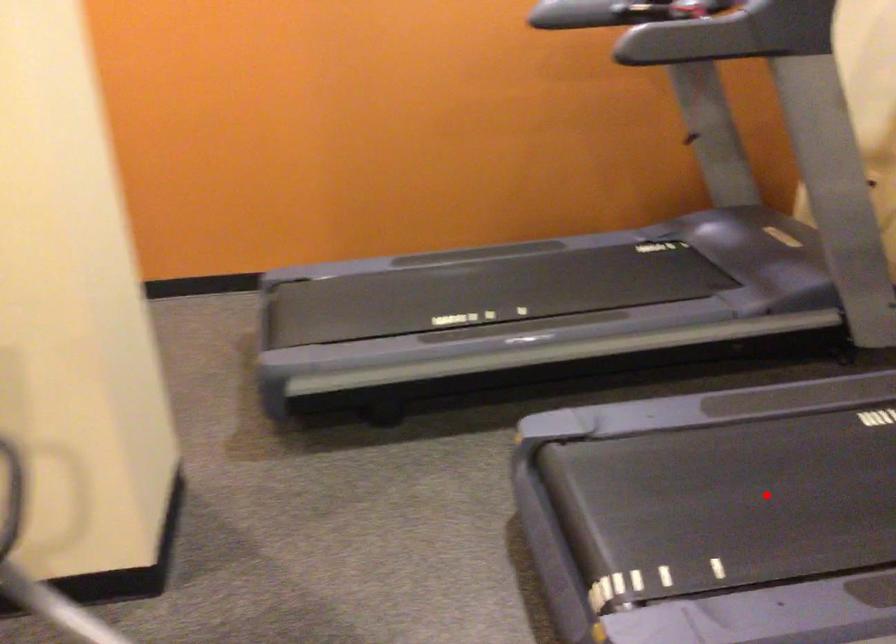
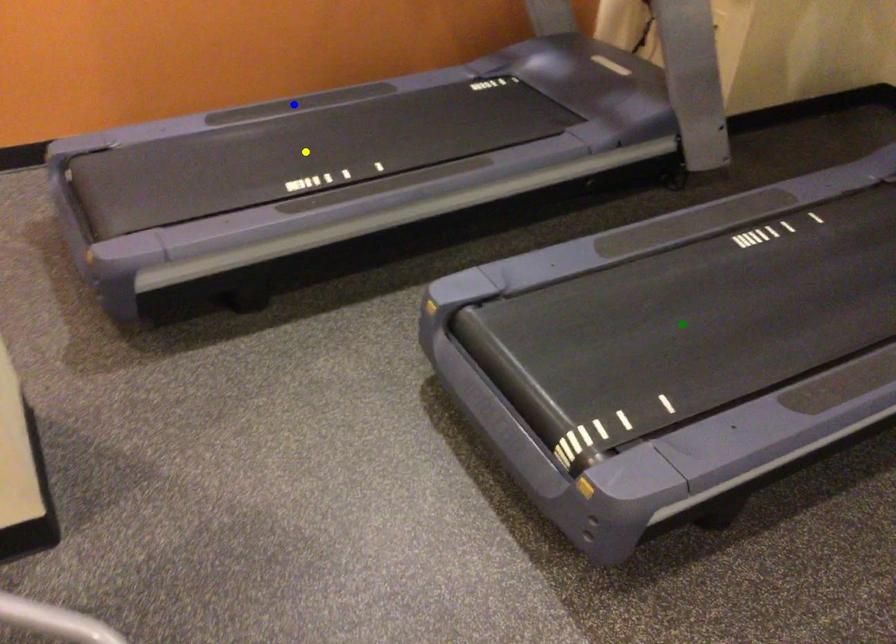
Question: I am providing you with two images of the same scene from different viewpoints. A red point is marked on the first image. You are given multiple points on the second image. In image 2, which mark is for the same physical point as the one in image 1?

Choices:
 (A) blue point
 (B) yellow point
 (C) green point

Answer: (C)